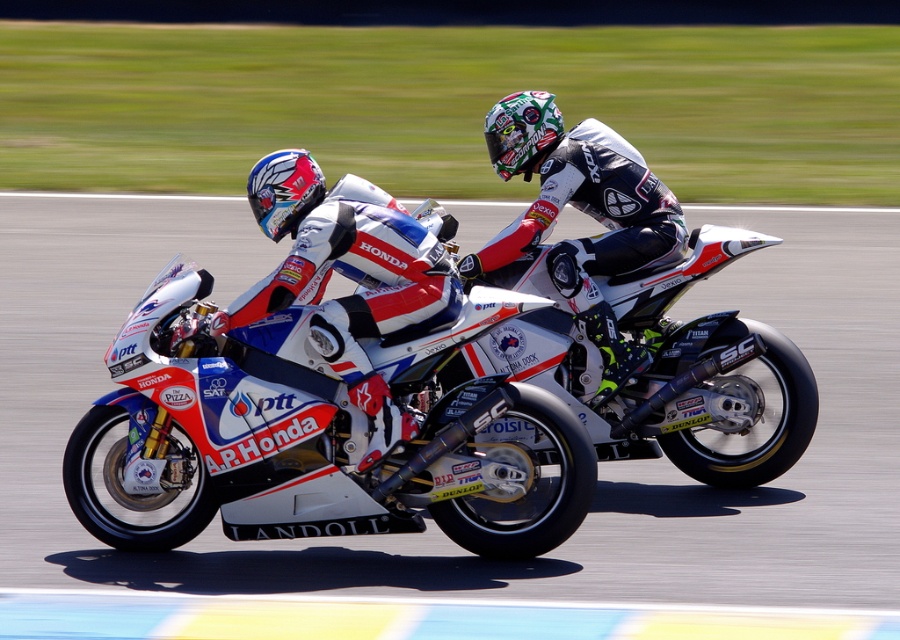
Measure the distance between white glossy motorcycle at center and white/red/blue suit at center.

15.08 inches

Between white glossy motorcycle at center and white/red/blue suit at center, which one appears on the right side from the viewer's perspective?

white/red/blue suit at center is more to the right.

The height and width of the screenshot is (640, 900). Find the location of `white glossy motorcycle at center`. white glossy motorcycle at center is located at coordinates (308, 445).

Does point (138, 422) come closer to viewer compared to point (546, 93)?

Yes, it is in front of point (546, 93).

Can you confirm if white glossy motorcycle at center is positioned to the right of white leather suit at center?

Incorrect, white glossy motorcycle at center is not on the right side of white leather suit at center.

Describe the element at coordinates (308, 445) in the screenshot. I see `white glossy motorcycle at center` at that location.

Locate an element on the screen. white glossy motorcycle at center is located at coordinates (308, 445).

Does white/red/blue suit at center appear on the left side of white leather suit at center?

Indeed, white/red/blue suit at center is positioned on the left side of white leather suit at center.

Which is behind, point (284, 291) or point (465, 268)?

Positioned behind is point (465, 268).

Who is more forward, (353, 211) or (597, 212)?

Point (353, 211)

Image resolution: width=900 pixels, height=640 pixels. I want to click on white/red/blue suit at center, so click(x=346, y=276).